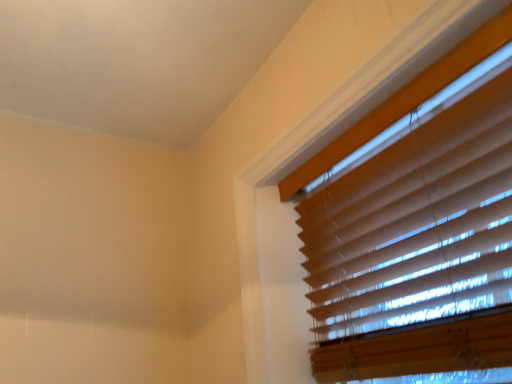
In order to face wooden blinds at upper right, should I rotate leftwards or rightwards?

Rotate your view right by about 18.052°.

Find the location of a particular element. wooden blinds at upper right is located at coordinates (416, 227).

The image size is (512, 384). What do you see at coordinates (416, 227) in the screenshot?
I see `wooden blinds at upper right` at bounding box center [416, 227].

Identify the location of wooden blinds at upper right. Image resolution: width=512 pixels, height=384 pixels. (416, 227).